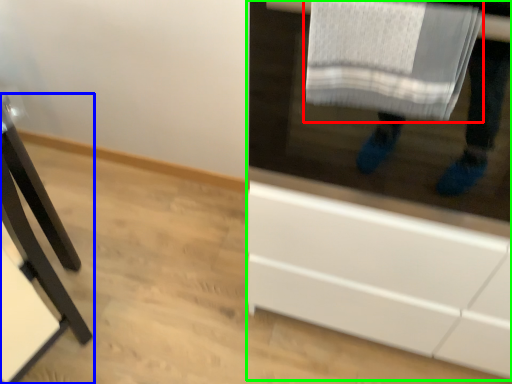
Question: Which object is the farthest from bath towel (highlighted by a red box)? Choose among these: furniture (highlighted by a blue box) or cabinetry (highlighted by a green box).

Choices:
 (A) furniture
 (B) cabinetry

Answer: (A)